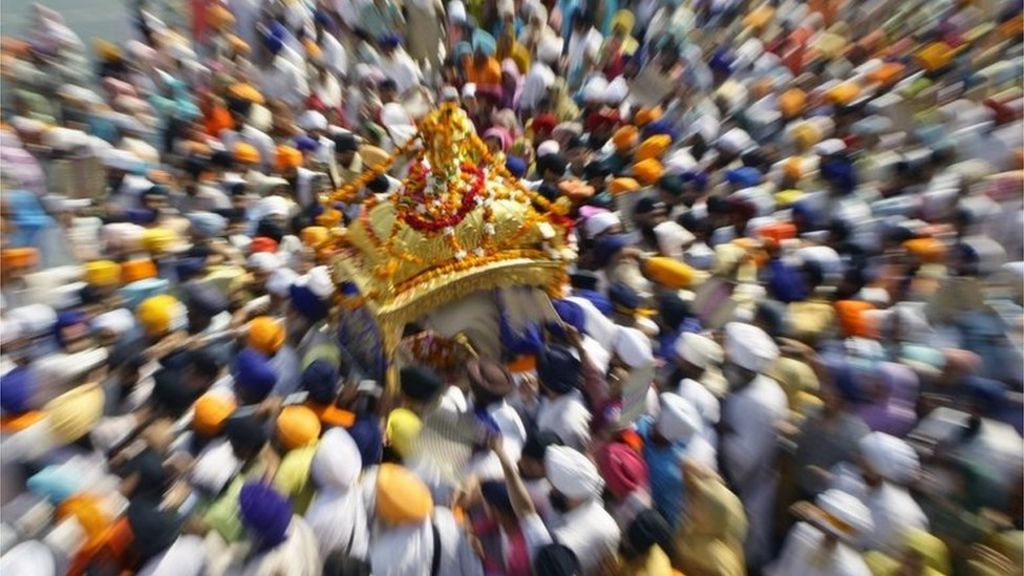
Where is `gray and blue curtains`? The height and width of the screenshot is (576, 1024). gray and blue curtains is located at coordinates (528, 309), (351, 329).